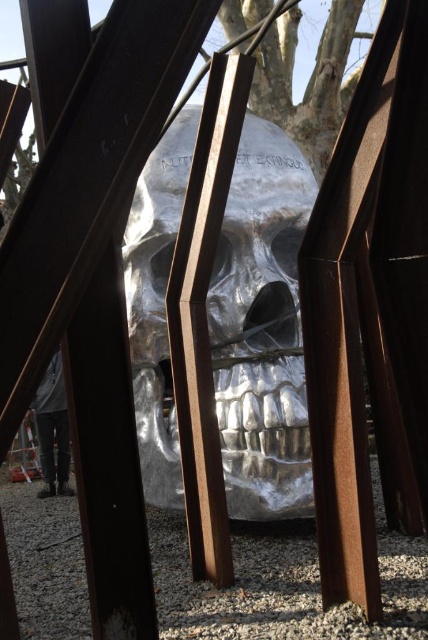
You are an art installer who needs to move the gray fabric pants at lower left closer to the metallic silver skull at center. The minimum distance required between them for safety is 8 feet. Can you move the pants to a position that is within the safety distance while still keeping them visible in the same room?

The metallic silver skull at center is currently 9.58 feet from the gray fabric pants at lower left. Since the safety distance is 8 feet, moving the pants closer to 8 feet or less would be within the required distance. However, you must ensure that after moving, the gray fabric pants at lower left remain visible in the same room as the metallic silver skull at center.

You are an art curator examining the sculpture installation. You notice the metallic silver skull at center and the gray fabric pants at lower left. Based on their positions, which object is located to the right of the other?

The metallic silver skull at center is positioned on the right side of gray fabric pants at lower left, so the metallic silver skull at center is to the right of the gray fabric pants at lower left.